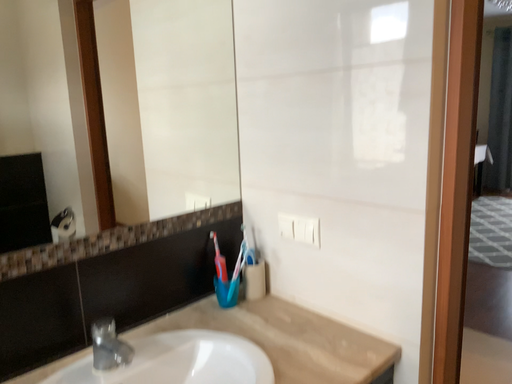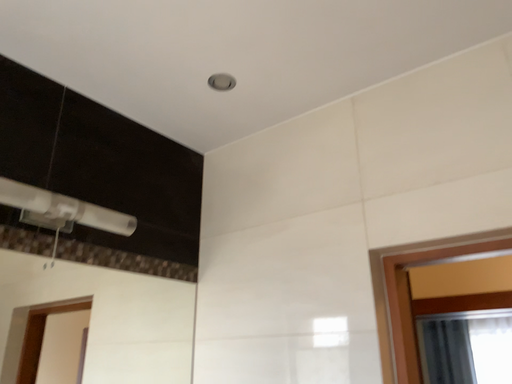
Question: Which way did the camera rotate in the video?

Choices:
 (A) rotated right
 (B) rotated left

Answer: (A)